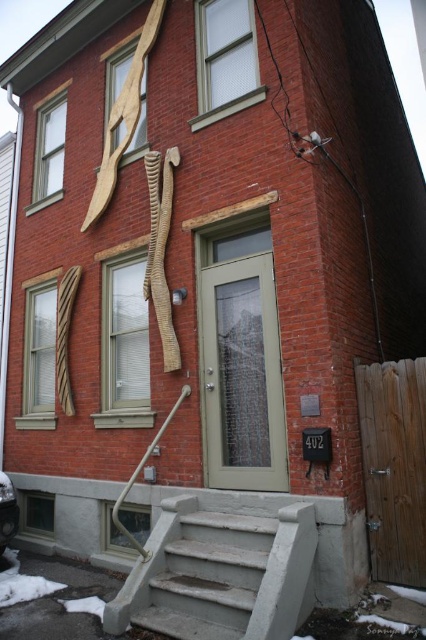
Is point (172, 570) behind point (120, 525)?

Yes.

Who is lower down, concrete steps at center or brushed metal handrail at lower center?

concrete steps at center is below.

Where is `concrete steps at center`? Image resolution: width=426 pixels, height=640 pixels. concrete steps at center is located at coordinates (219, 573).